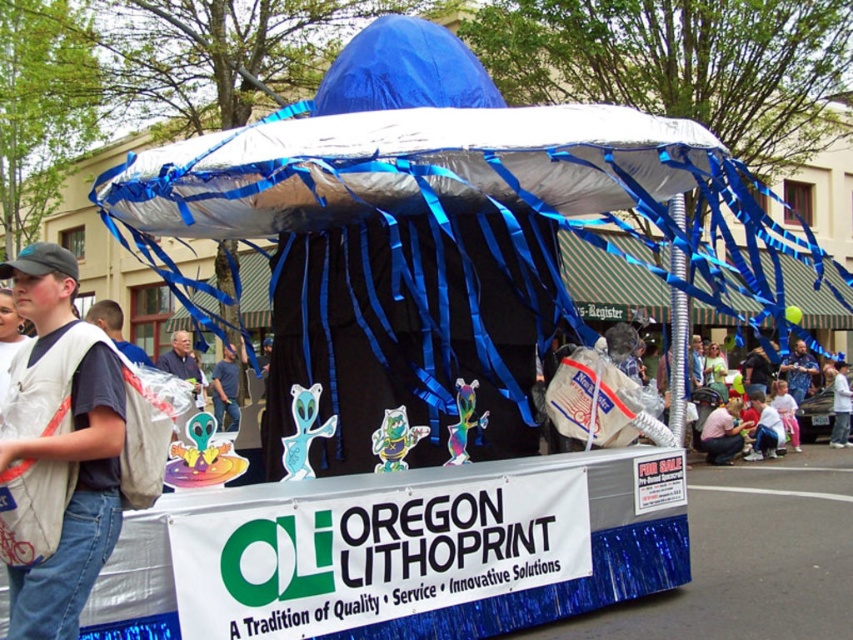
You are an observer standing in front of the Oregon Lithoprint float at the parade. You notice two garments displayed on a mannequin at the center of the float. The garments are a white fabric vest at center and a blue fabric shirt at center. Which garment is taller?

The white fabric vest at center is much taller than the blue fabric shirt at center.

From the picture: You are standing in front of the Oregon Lithoprint float and notice two points marked on it. The first point is at coordinates point (59, 317) and the second is at point (180, 348). Which point is closer to you?

Point (59, 317) is closer to the viewer than point (180, 348).